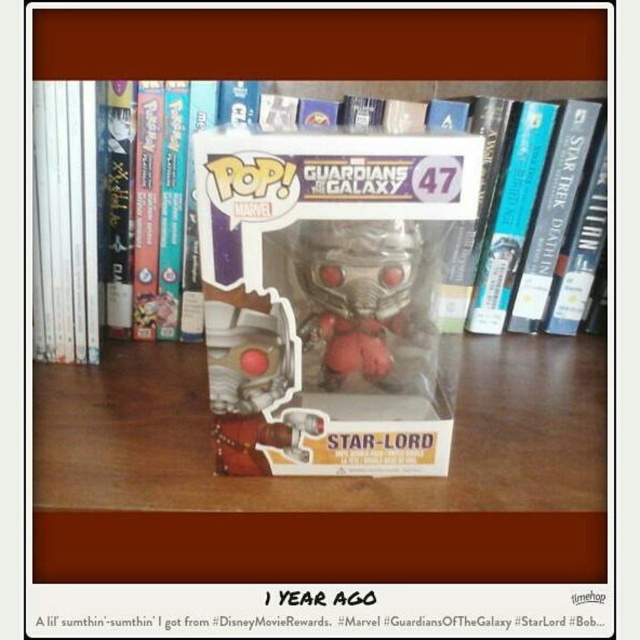
Between clear plastic pop vinyl figure at center and metallic silver helmet at center, which one has more height?

clear plastic pop vinyl figure at center is taller.

Where is `clear plastic pop vinyl figure at center`? This screenshot has height=640, width=640. clear plastic pop vinyl figure at center is located at coordinates (67, 220).

Where is `clear plastic pop vinyl figure at center`? Image resolution: width=640 pixels, height=640 pixels. clear plastic pop vinyl figure at center is located at coordinates (67, 220).

Is point (561, 406) farther from viewer compared to point (364, 337)?

Yes, point (561, 406) is farther from viewer.

Can you confirm if wooden table at center is positioned to the left of metallic silver helmet at center?

Incorrect, wooden table at center is not on the left side of metallic silver helmet at center.

Identify the location of wooden table at center. The height and width of the screenshot is (640, 640). (321, 480).

Locate an element on the screen. wooden table at center is located at coordinates (321, 480).

Is clear plastic box at center thinner than clear plastic pop vinyl figure at center?

Yes, clear plastic box at center is thinner than clear plastic pop vinyl figure at center.

Where is `clear plastic box at center`? The height and width of the screenshot is (640, 640). clear plastic box at center is located at coordinates (330, 296).